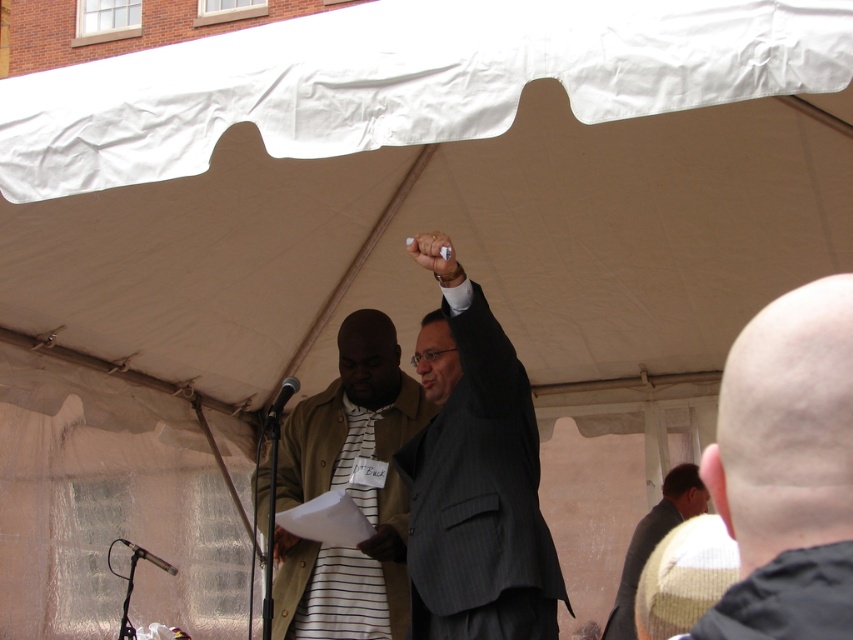
Identify the location of pinstriped suit at center. The image size is (853, 640). (479, 497).

Which of these two, pinstriped suit at center or striped fabric shirt at center, stands shorter?

pinstriped suit at center

Which is in front, point (524, 429) or point (383, 612)?

Point (524, 429) is in front.

This screenshot has height=640, width=853. In order to click on pinstriped suit at center in this screenshot , I will do `click(479, 497)`.

Does pinstriped suit at center appear over white matte pen at upper center?

No, pinstriped suit at center is not above white matte pen at upper center.

Who is more distant from viewer, (x=457, y=324) or (x=442, y=260)?

Positioned behind is point (x=457, y=324).

Where is `pinstriped suit at center`? This screenshot has height=640, width=853. pinstriped suit at center is located at coordinates (479, 497).

At what (x,y) coordinates should I click in order to perform the action: click on pinstriped suit at center. Please return your answer as a coordinate pair (x, y). This screenshot has width=853, height=640. Looking at the image, I should click on tap(479, 497).

In the scene shown: Is black fabric at lower right bigger than silver metallic microphone at lower left?

No.

The image size is (853, 640). Find the location of `black fabric at lower right`. black fabric at lower right is located at coordinates pos(786,598).

This screenshot has height=640, width=853. Find the location of `black fabric at lower right`. black fabric at lower right is located at coordinates (786, 598).